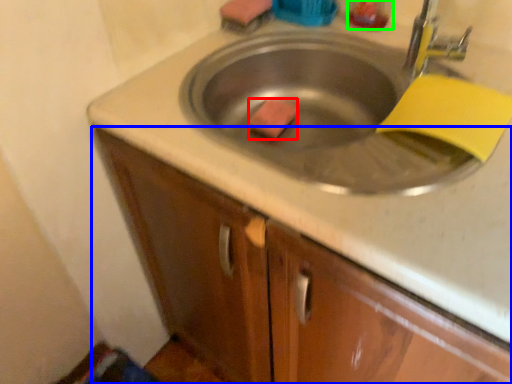
Question: Which object is positioned farthest from soap (highlighted by a red box)? Select from cabinetry (highlighted by a blue box) and liquid (highlighted by a green box).

Choices:
 (A) cabinetry
 (B) liquid

Answer: (A)